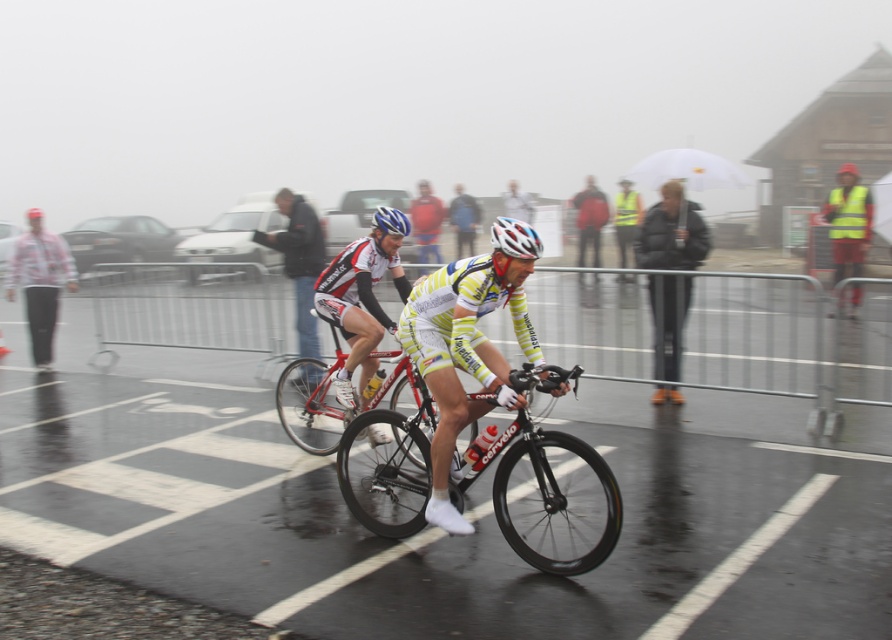
Between yellow/white jersey at center and blue matte bicycle helmet at center, which one appears on the right side from the viewer's perspective?

From the viewer's perspective, yellow/white jersey at center appears more on the right side.

Is yellow/white jersey at center positioned behind blue matte bicycle helmet at center?

No.

Between point (438, 451) and point (380, 216), which one is positioned behind?

Point (380, 216)

Where is `yellow/white jersey at center`? This screenshot has width=892, height=640. yellow/white jersey at center is located at coordinates (463, 353).

Between shiny black bicycle at center and dark gray jacket at center, which one appears on the left side from the viewer's perspective?

From the viewer's perspective, dark gray jacket at center appears more on the left side.

Is shiny black bicycle at center positioned before dark gray jacket at center?

Yes.

The image size is (892, 640). Describe the element at coordinates (550, 500) in the screenshot. I see `shiny black bicycle at center` at that location.

At what (x,y) coordinates should I click in order to perform the action: click on shiny black bicycle at center. Please return your answer as a coordinate pair (x, y). The width and height of the screenshot is (892, 640). Looking at the image, I should click on (550, 500).

Does shiny black bicycle at center appear over white matte bicycle helmet at center?

Actually, shiny black bicycle at center is below white matte bicycle helmet at center.

Is shiny black bicycle at center below white matte bicycle helmet at center?

Yes.

The width and height of the screenshot is (892, 640). In order to click on shiny black bicycle at center in this screenshot , I will do `click(550, 500)`.